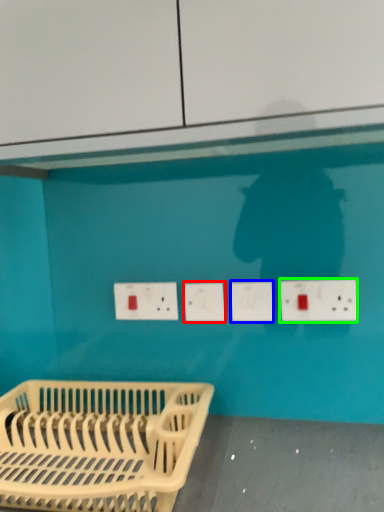
Question: Based on their relative distances, which object is nearer to socket (highlighted by a red box)? Choose from socket (highlighted by a blue box) and electric outlet (highlighted by a green box).

Choices:
 (A) socket
 (B) electric outlet

Answer: (A)